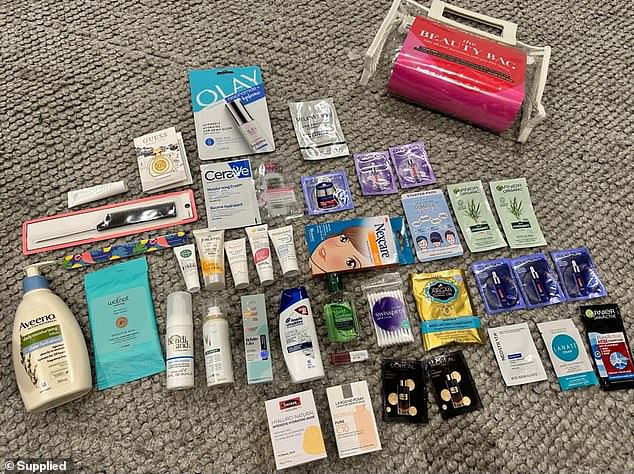
Where is `small plastic tubes of beauty products`? The width and height of the screenshot is (634, 474). small plastic tubes of beauty products is located at coordinates [x=186, y=264], [x=219, y=260], [x=234, y=260], [x=253, y=248], [x=283, y=246], [x=91, y=195].